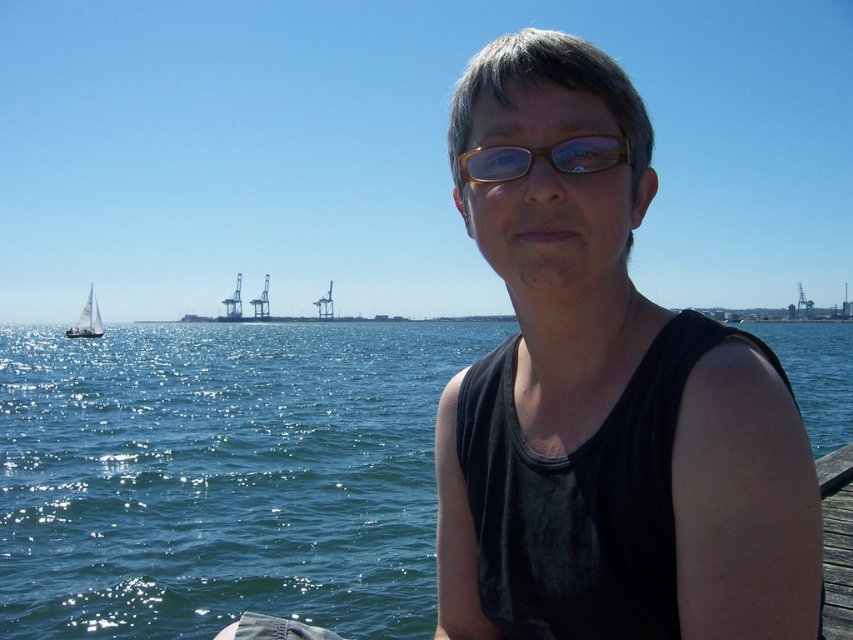
Is the position of wooden at right more distant than that of transparent plastic glasses at center?

Yes, wooden at right is further from the viewer.

Is wooden at right to the right of transparent plastic glasses at center from the viewer's perspective?

Correct, you'll find wooden at right to the right of transparent plastic glasses at center.

Between point (830, 609) and point (544, 150), which one is positioned behind?

The point (830, 609) is behind.

What are the coordinates of `wooden at right` in the screenshot? It's located at (837, 540).

Can you confirm if wooden at right is taller than white sailboat at left?

No.

Where is `wooden at right`? The image size is (853, 640). wooden at right is located at coordinates (837, 540).

In the scene shown: Which is more to the right, black matte tank top at center or wooden at right?

wooden at right is more to the right.

Does black matte tank top at center appear under wooden at right?

No, black matte tank top at center is not below wooden at right.

Locate an element on the screen. Image resolution: width=853 pixels, height=640 pixels. black matte tank top at center is located at coordinates (606, 403).